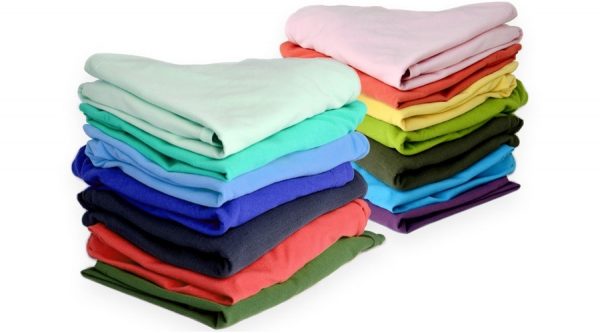
The width and height of the screenshot is (600, 333). Identify the location of clothes in 1st stack. point(214,114), point(240,157), point(242,176), point(243,208), point(241,244), point(253,272), point(247,316).